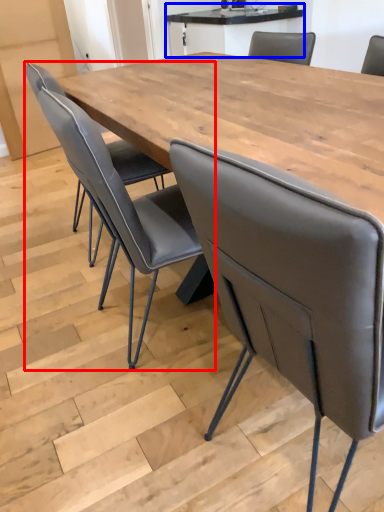
Question: Which object is further to the camera taking this photo, chair (highlighted by a red box) or table (highlighted by a blue box)?

Choices:
 (A) chair
 (B) table

Answer: (B)